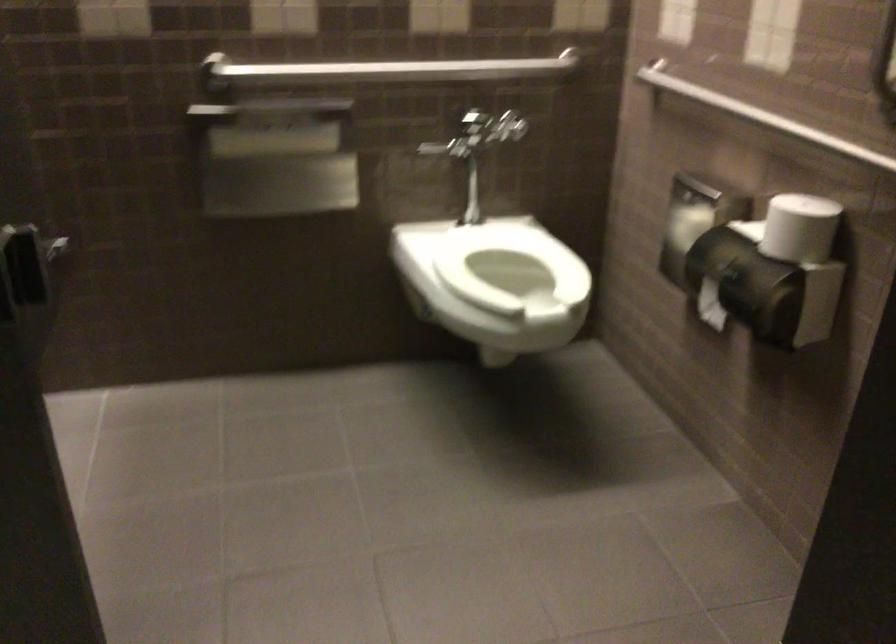
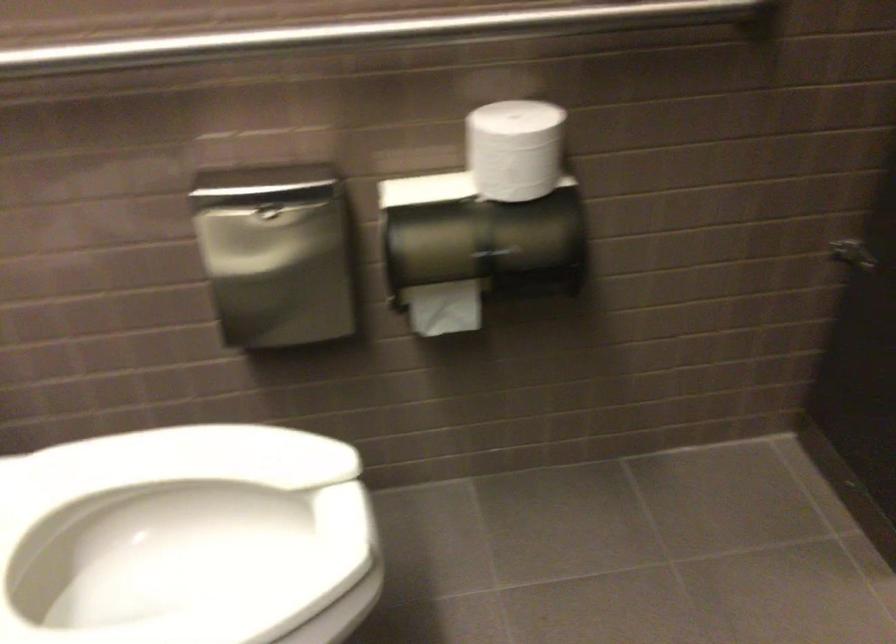
Locate, in the second image, the point that corresponds to point 769,212 in the first image.

(514, 149)